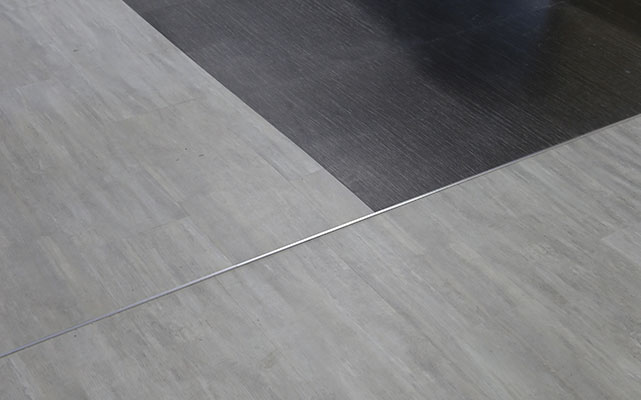
You are a GUI agent. You are given a task and a screenshot of the screen. Output one action in this format:
    pyautogui.click(x=<x>, y=<y>)
    Task: Click on the light reflection on metal line in floor
    
    Given the screenshot: What is the action you would take?
    pyautogui.click(x=336, y=226)